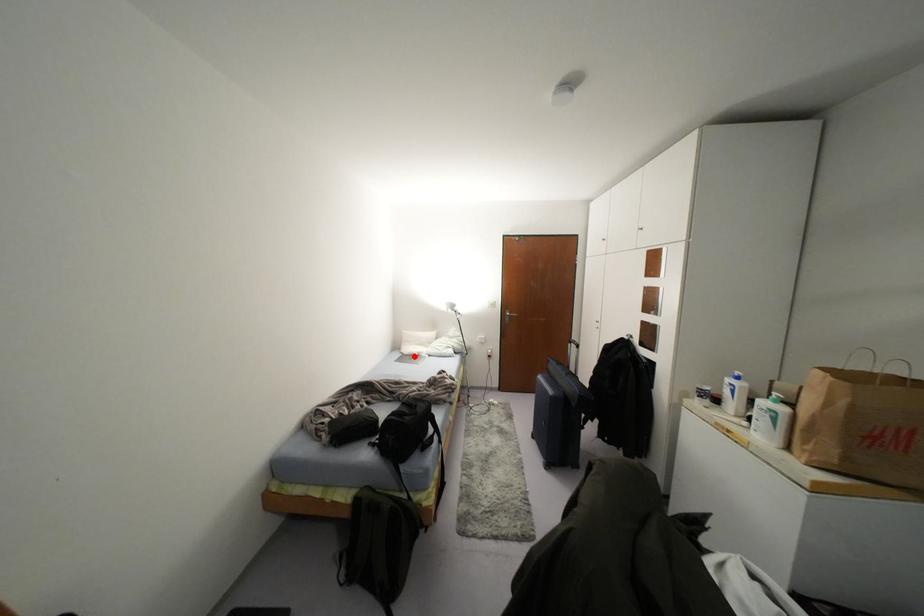
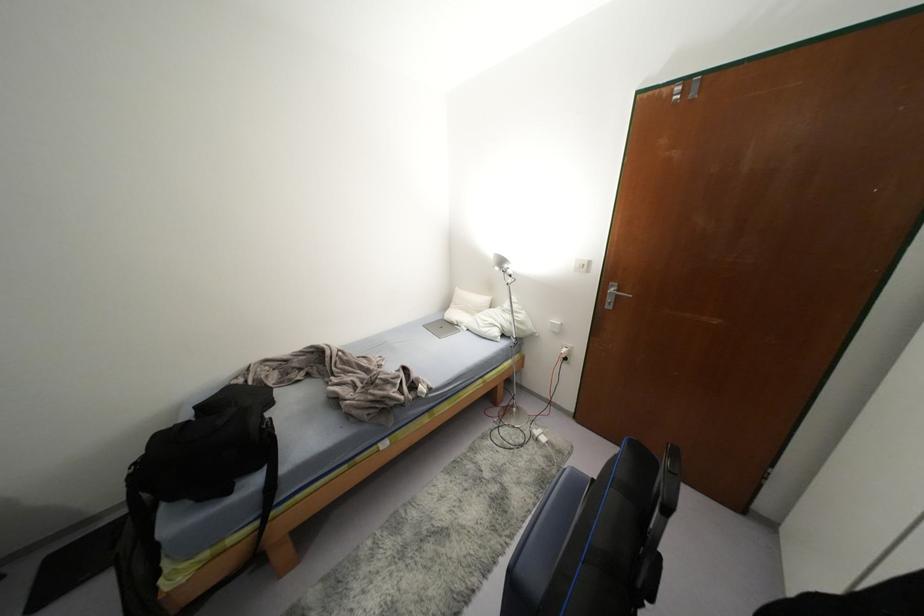
Question: I am providing you with two images of the same scene from different viewpoints. Image1 has a red point marked. In image2, the corresponding 3D location appears at what relative position? Reply with the corresponding letter.

Choices:
 (A) Closer
 (B) Farther

Answer: (A)